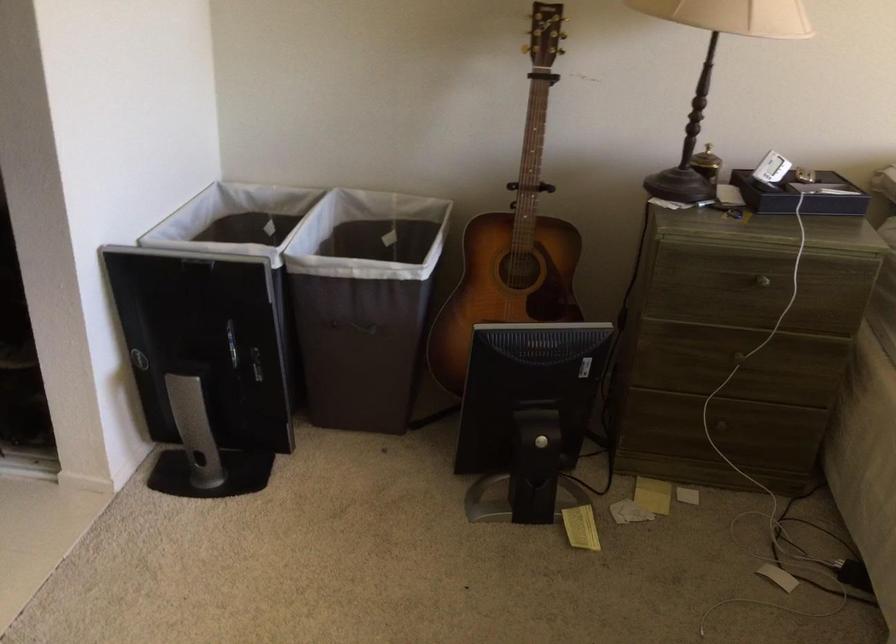
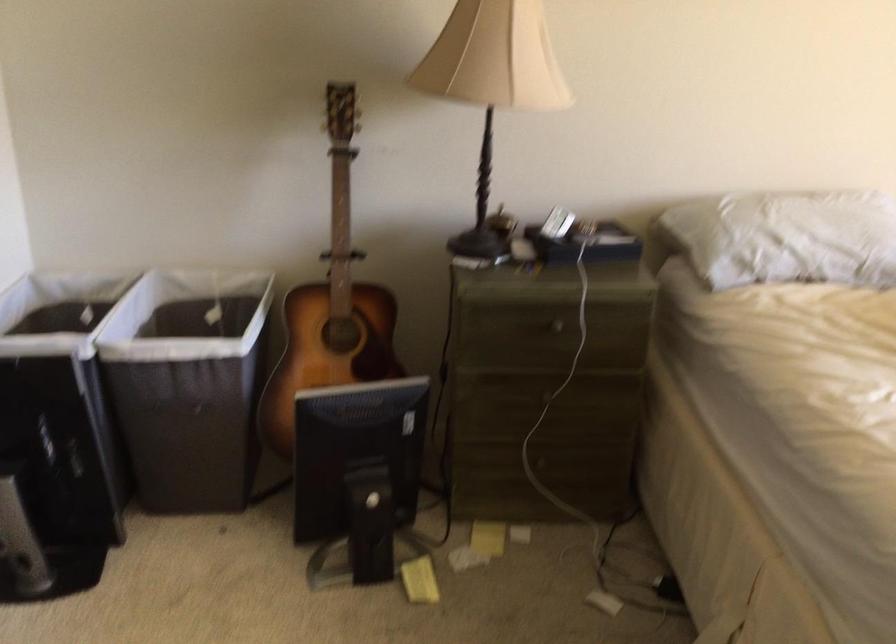
Find the pixel in the second image that matches point (362, 303) in the first image.

(188, 384)